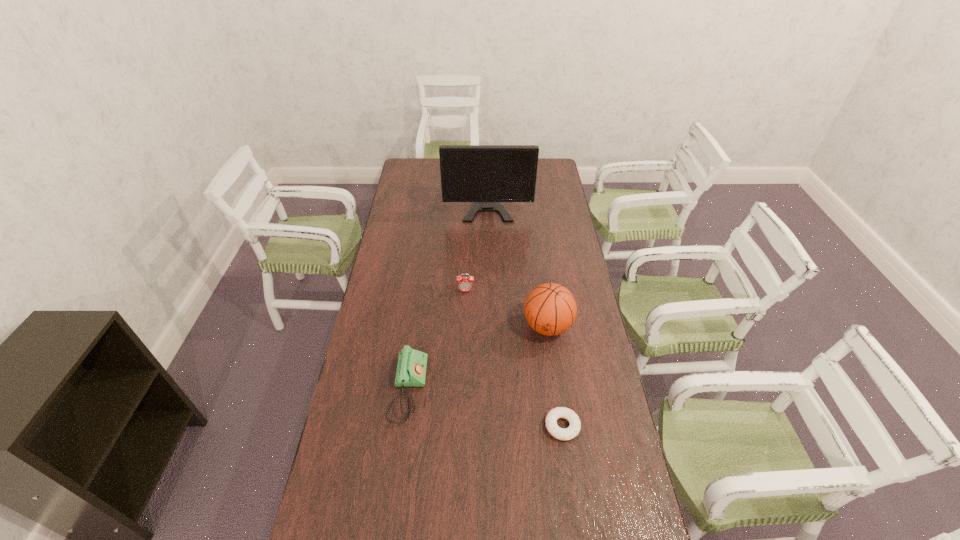
The image size is (960, 540). What are the coordinates of `free point between the telephone and the farthest object` in the screenshot? It's located at (448, 291).

Where is `vacant region between the tallest object and the third shortest object`? The height and width of the screenshot is (540, 960). vacant region between the tallest object and the third shortest object is located at coordinates (476, 242).

Locate which object is the third closest to the shortest object. Please provide its 2D coordinates. Your answer should be formatted as a tuple, i.e. [(x, y)], where the tuple contains the x and y coordinates of a point satisfying the conditions above.

[(465, 284)]

The image size is (960, 540). Find the location of `the third closest object to the fourth tallest object`. the third closest object to the fourth tallest object is located at coordinates (572, 431).

Find the location of `vacant area that satisfies the following two spatial constraints: 1. on the screen side of the doughnut; 2. on the left side of the computer monitor`. vacant area that satisfies the following two spatial constraints: 1. on the screen side of the doughnut; 2. on the left side of the computer monitor is located at coordinates (492, 426).

Identify the location of vacant position in the image that satisfies the following two spatial constraints: 1. on the face of the shortest object; 2. on the right side of the third tallest object. The height and width of the screenshot is (540, 960). pyautogui.click(x=461, y=426).

Identify the location of vacant position in the image that satisfies the following two spatial constraints: 1. on the face of the third shortest object; 2. on the dial of the fourth tallest object. click(463, 389).

You are a GUI agent. You are given a task and a screenshot of the screen. Output one action in this format:
    pyautogui.click(x=<x>, y=<y>)
    Task: Click on the vacant space that satisfies the following two spatial constraints: 1. on the back side of the shortest object; 2. on the dial of the telephone
    This screenshot has height=540, width=960.
    Given the screenshot: What is the action you would take?
    pyautogui.click(x=557, y=389)